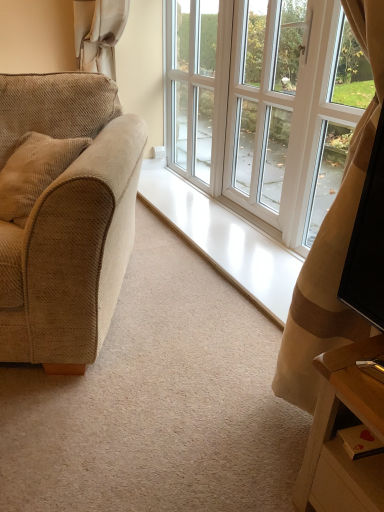
You are a GUI agent. You are given a task and a screenshot of the screen. Output one action in this format:
    pyautogui.click(x=<x>, y=<y>)
    Task: Click on the free space below white glass window at center (from a real-world perspective)
    Image resolution: width=384 pixels, height=512 pixels.
    Given the screenshot: What is the action you would take?
    pyautogui.click(x=240, y=331)